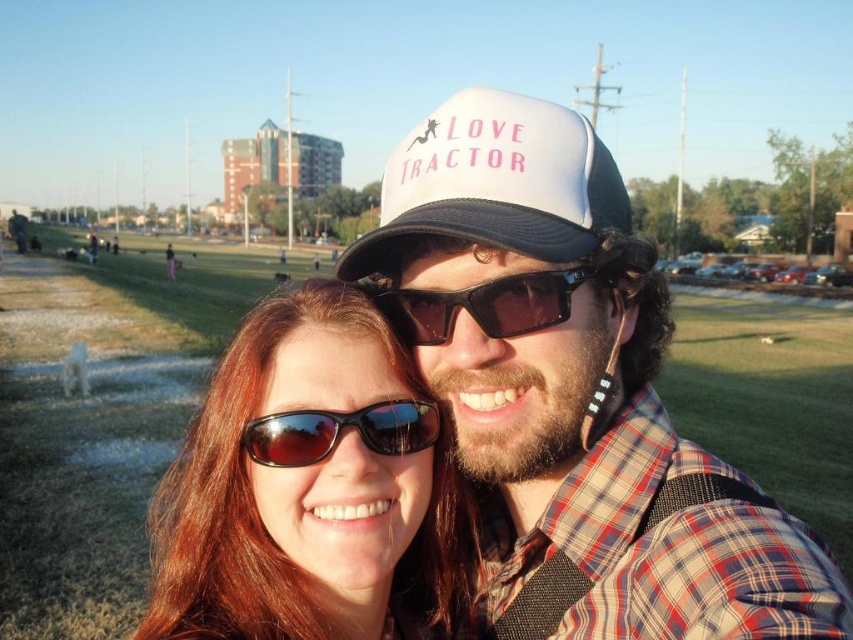
You are standing in the park and see two people in the center. The first person has a white mesh cap at center and the second has shiny brown hair at center. If you want to take a photo of both, which one should you focus on first to ensure both are in focus?

You should focus on the white mesh cap at center first because it is closer to the viewer than the shiny brown hair at center, so focusing on the closer object will help both be in focus.

You are a photographer trying to capture a clear shot of the white matte baseball cap at center and the black plastic sunglasses at center. Which object is closer to the camera?

The white matte baseball cap at center is closer to the camera because the black plastic sunglasses at center is behind it.